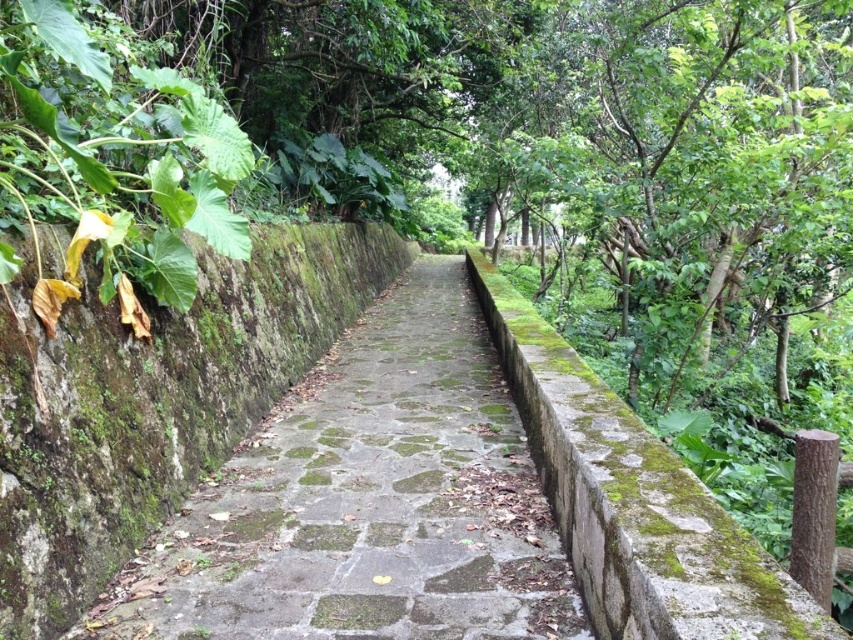
Question: Which point is closer to the camera?

Choices:
 (A) green mossy stone path at center
 (B) green leafy plant at left

Answer: (B)

Question: Which object appears farthest from the camera in this image?

Choices:
 (A) green mossy stone path at center
 (B) green leafy plant at left

Answer: (A)

Question: Which point appears farthest from the camera in this image?

Choices:
 (A) (90, 68)
 (B) (154, 627)

Answer: (A)

Question: Is green mossy stone path at center bigger than green leafy plant at left?

Choices:
 (A) yes
 (B) no

Answer: (A)

Question: Does green mossy stone path at center appear under green leafy plant at left?

Choices:
 (A) yes
 (B) no

Answer: (A)

Question: Can you confirm if green mossy stone path at center is wider than green leafy plant at left?

Choices:
 (A) yes
 (B) no

Answer: (A)